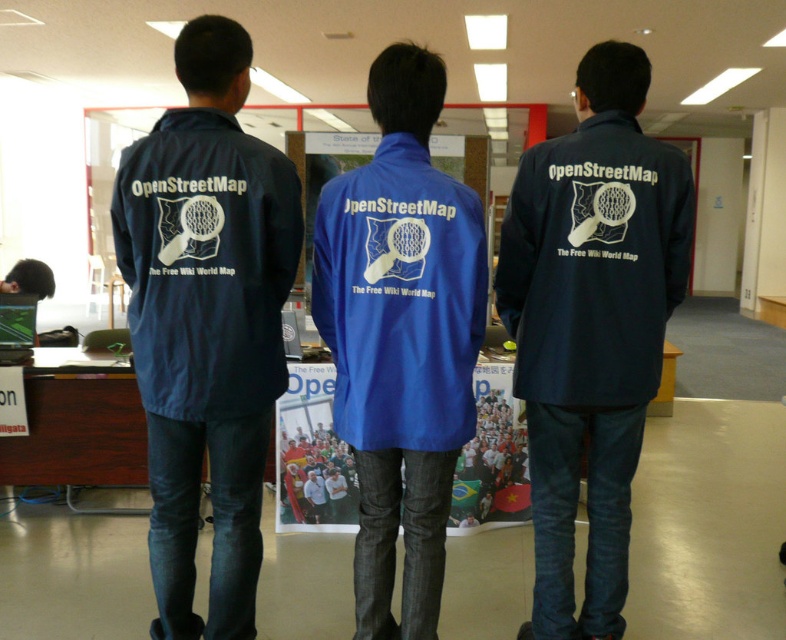
Question: Among these points, which one is farthest from the camera?

Choices:
 (A) (410, 225)
 (B) (79, 368)
 (C) (248, 456)

Answer: (B)

Question: Does navy blue jacket at center appear on the right side of blue fabric jacket at center?

Choices:
 (A) no
 (B) yes

Answer: (B)

Question: Does navy blue jacket at center have a smaller size compared to brushed metal desk at center?

Choices:
 (A) yes
 (B) no

Answer: (B)

Question: Which of the following is the farthest from the observer?

Choices:
 (A) navy blue jacket at left
 (B) blue fabric jacket at center
 (C) navy blue jacket at center
 (D) brushed metal desk at center

Answer: (D)

Question: Does navy blue jacket at left have a lesser width compared to brushed metal desk at center?

Choices:
 (A) no
 (B) yes

Answer: (B)

Question: Estimate the real-world distances between objects in this image. Which object is farther from the blue fabric jacket at center?

Choices:
 (A) navy blue jacket at center
 (B) navy blue jacket at left

Answer: (A)